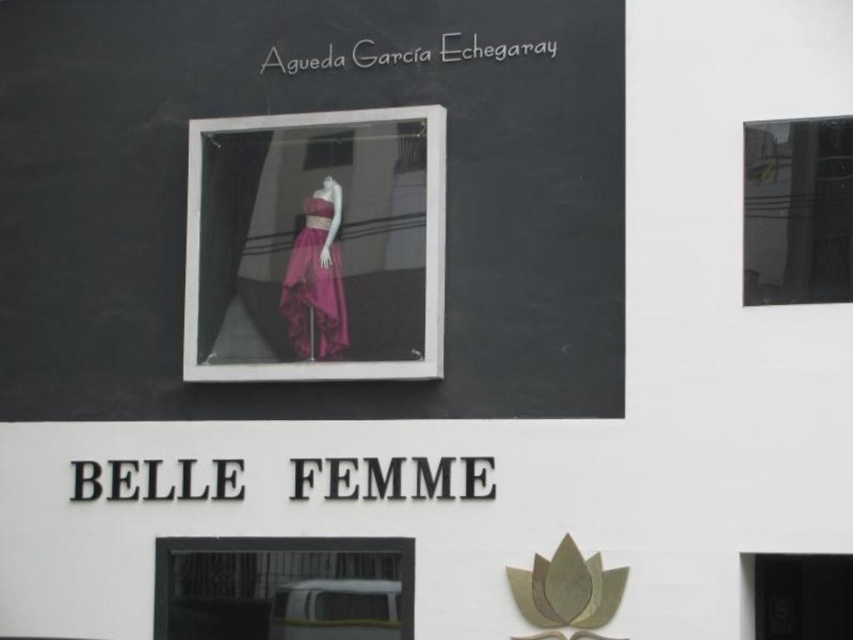
Question: Among these objects, which one is nearest to the camera?

Choices:
 (A) pink satin dress at center
 (B) white plastic van at lower center

Answer: (B)

Question: Is pink satin dress at center to the left of purple satin dress at center from the viewer's perspective?

Choices:
 (A) no
 (B) yes

Answer: (A)

Question: Is pink satin dress at center to the right of white plastic van at lower center from the viewer's perspective?

Choices:
 (A) no
 (B) yes

Answer: (B)

Question: Which object is the closest to the white plastic van at lower center?

Choices:
 (A) purple satin dress at center
 (B) pink satin dress at center

Answer: (A)

Question: Which point appears farthest from the camera in this image?

Choices:
 (A) (265, 564)
 (B) (305, 268)
 (C) (387, 289)

Answer: (B)

Question: Is white plastic van at lower center bigger than purple satin dress at center?

Choices:
 (A) no
 (B) yes

Answer: (B)